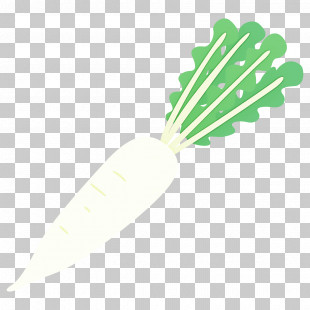
In order to click on spaces where table cover shows through leaves in this screenshot , I will do `click(240, 62)`, `click(204, 105)`, `click(220, 86)`, `click(238, 91)`, `click(259, 76)`, `click(224, 51)`, `click(208, 72)`, `click(220, 111)`, `click(256, 45)`, `click(277, 63)`.